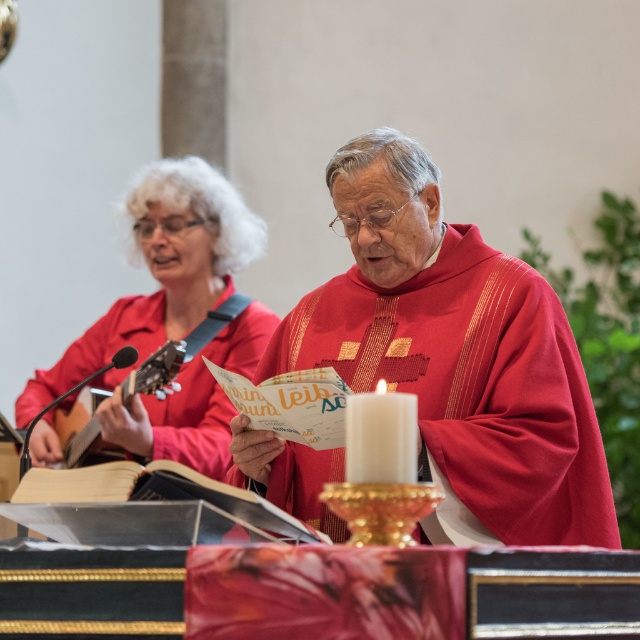
Consider the image. Can you confirm if matte red shirt at upper left is wider than acoustic wood guitar at left?

Indeed, matte red shirt at upper left has a greater width compared to acoustic wood guitar at left.

Consider the image. Between matte red shirt at upper left and acoustic wood guitar at left, which one is positioned lower?

acoustic wood guitar at left

Between point (141, 332) and point (74, 433), which one is positioned in front?

Point (74, 433) is more forward.

Where is `matte red shirt at upper left`? The image size is (640, 640). matte red shirt at upper left is located at coordinates (163, 269).

You are a GUI agent. You are given a task and a screenshot of the screen. Output one action in this format:
    pyautogui.click(x=<x>, y=<y>)
    Task: Click on the white wax candle at center
    This screenshot has width=640, height=640.
    Given the screenshot: What is the action you would take?
    pyautogui.click(x=380, y=436)

Where is `matte red shirt at upper left`? matte red shirt at upper left is located at coordinates (163, 269).

Who is taller, matte red shirt at upper left or white wax candle at center?

Standing taller between the two is matte red shirt at upper left.

Is point (164, 452) positioned after point (385, 410)?

Yes, point (164, 452) is behind point (385, 410).

The width and height of the screenshot is (640, 640). Find the location of `matte red shirt at upper left`. matte red shirt at upper left is located at coordinates (163, 269).